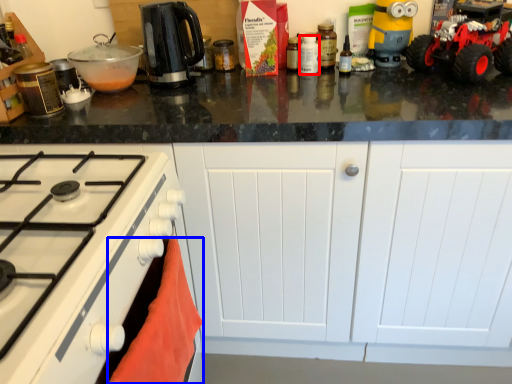
Question: Which object is further to the camera taking this photo, kitchen appliance (highlighted by a red box) or material (highlighted by a blue box)?

Choices:
 (A) kitchen appliance
 (B) material

Answer: (A)